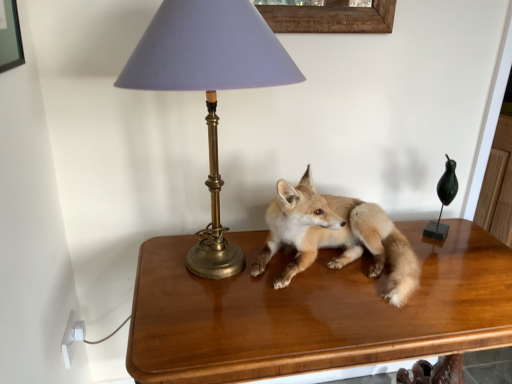
Question: Is shiny brown table at center to the left or to the right of matte gold lamp at upper left in the image?

Choices:
 (A) left
 (B) right

Answer: (B)

Question: From the image's perspective, is shiny brown table at center positioned above or below matte gold lamp at upper left?

Choices:
 (A) below
 (B) above

Answer: (A)

Question: Which of these objects is positioned farthest from the matte gold lamp at upper left?

Choices:
 (A) shiny brown table at center
 (B) light brown fur fox at center

Answer: (A)

Question: Estimate the real-world distances between objects in this image. Which object is farther from the shiny brown table at center?

Choices:
 (A) light brown fur fox at center
 (B) matte gold lamp at upper left

Answer: (B)